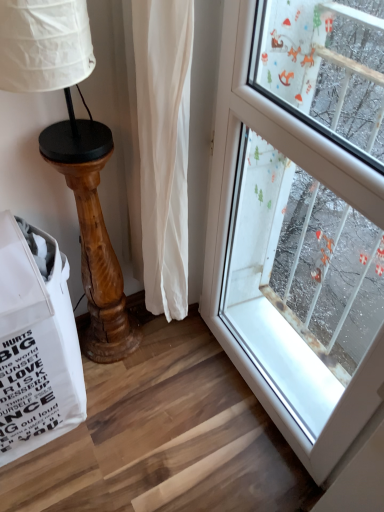
Identify the location of free space above wooden table lamp at left (from a real-world perspective). (74, 138).